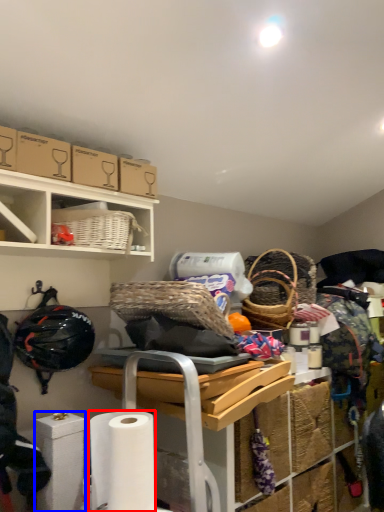
Question: Which of the following is the farthest to the observer, toilet paper (highlighted by a red box) or toilet paper (highlighted by a blue box)?

Choices:
 (A) toilet paper
 (B) toilet paper

Answer: (B)